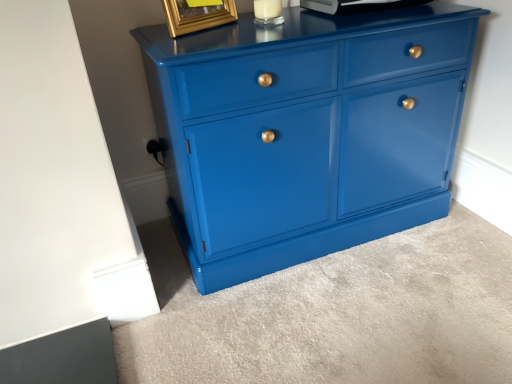
You are a GUI agent. You are given a task and a screenshot of the screen. Output one action in this format:
    pyautogui.click(x=<x>, y=<y>)
    Task: Click on the unoccupied area in front of gold metallic picture frame at upper center
    The image size is (512, 384).
    Given the screenshot: What is the action you would take?
    pyautogui.click(x=205, y=42)